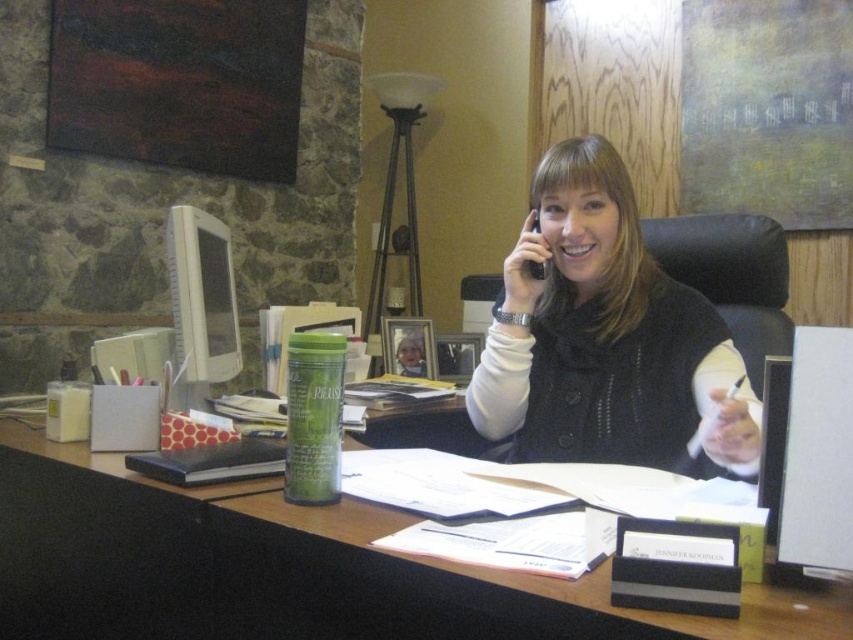
You are an office assistant who needs to place a new document organizer on the desk. The organizer requires 10 inches of space. Can you determine if there is enough space on the wooden desk at center based on its position relative to the matte black vest at center?

The wooden desk at center is positioned on the left side of matte black vest at center. Since the desk is to the left of the vest, it may have sufficient space for the organizer, but the exact dimensions aren